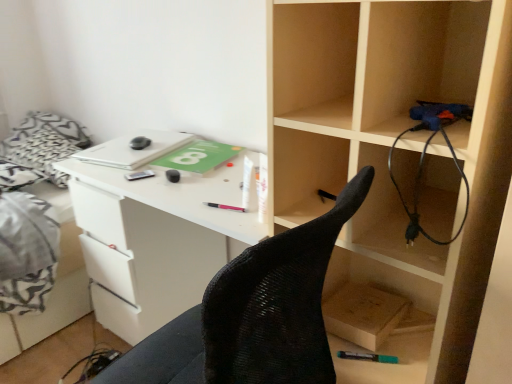
Question: Is the depth of teal matte marker at lower center, placed as the 4th stationery when sorted from left to right, greater than that of wooden box at lower right?

Choices:
 (A) yes
 (B) no

Answer: (A)

Question: Is teal matte marker at lower center, the 1th stationery ordered from the bottom, bigger than wooden box at lower right?

Choices:
 (A) no
 (B) yes

Answer: (A)

Question: From the image's perspective, is teal matte marker at lower center, the fourth stationery positioned from the back, located above wooden box at lower right?

Choices:
 (A) no
 (B) yes

Answer: (A)

Question: Does teal matte marker at lower center, which is the 4th stationery from top to bottom, have a greater width compared to wooden box at lower right?

Choices:
 (A) no
 (B) yes

Answer: (A)

Question: Does teal matte marker at lower center, the 1th stationery ordered from the bottom, turn towards wooden box at lower right?

Choices:
 (A) no
 (B) yes

Answer: (A)

Question: Considering the relative sizes of teal matte marker at lower center, which is the 4th stationery from top to bottom, and wooden box at lower right in the image provided, is teal matte marker at lower center, which is the 4th stationery from top to bottom, thinner than wooden box at lower right?

Choices:
 (A) no
 (B) yes

Answer: (B)

Question: Does black rubber mouse at center, which ranks as the fourth stationery in bottom-to-top order, have a larger size compared to black mesh chair at center?

Choices:
 (A) no
 (B) yes

Answer: (A)

Question: Is black rubber mouse at center, acting as the 3th stationery starting from the front, to the right of black mesh chair at center from the viewer's perspective?

Choices:
 (A) yes
 (B) no

Answer: (B)

Question: Is the position of black rubber mouse at center, which ranks as the fourth stationery in bottom-to-top order, more distant than that of black mesh chair at center?

Choices:
 (A) no
 (B) yes

Answer: (B)

Question: Could you tell me if black rubber mouse at center, which ranks as the fourth stationery in bottom-to-top order, is turned towards black mesh chair at center?

Choices:
 (A) yes
 (B) no

Answer: (B)

Question: Is black rubber mouse at center, which is the 1th stationery from top to bottom, smaller than black mesh chair at center?

Choices:
 (A) no
 (B) yes

Answer: (B)

Question: From the image's perspective, does black rubber mouse at center, which ranks as the second stationery in back-to-front order, appear lower than black mesh chair at center?

Choices:
 (A) no
 (B) yes

Answer: (A)

Question: From a real-world perspective, is black rubber wire at right on white fabric bed at left?

Choices:
 (A) no
 (B) yes

Answer: (B)